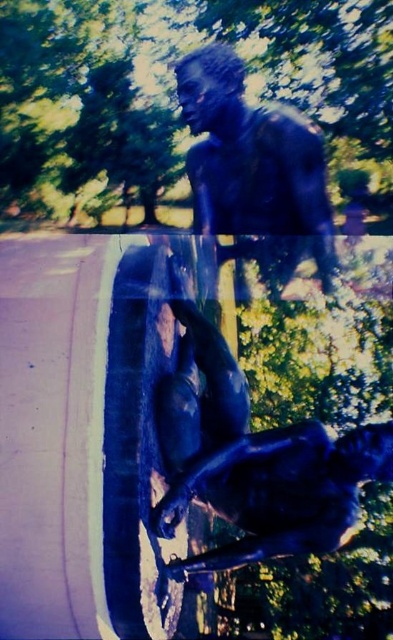
Does shiny bronze statue at center appear over bronze statue at upper center?

Incorrect, shiny bronze statue at center is not positioned above bronze statue at upper center.

Is shiny bronze statue at center bigger than bronze statue at upper center?

Yes.

What do you see at coordinates (253, 461) in the screenshot? This screenshot has width=393, height=640. I see `shiny bronze statue at center` at bounding box center [253, 461].

This screenshot has width=393, height=640. In order to click on shiny bronze statue at center in this screenshot , I will do `click(253, 461)`.